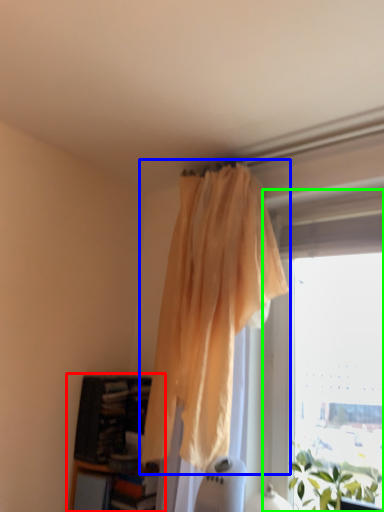
Question: Considering the real-world distances, which object is farthest from bookcase (highlighted by a red box)? curtain (highlighted by a blue box) or window (highlighted by a green box)?

Choices:
 (A) curtain
 (B) window

Answer: (B)